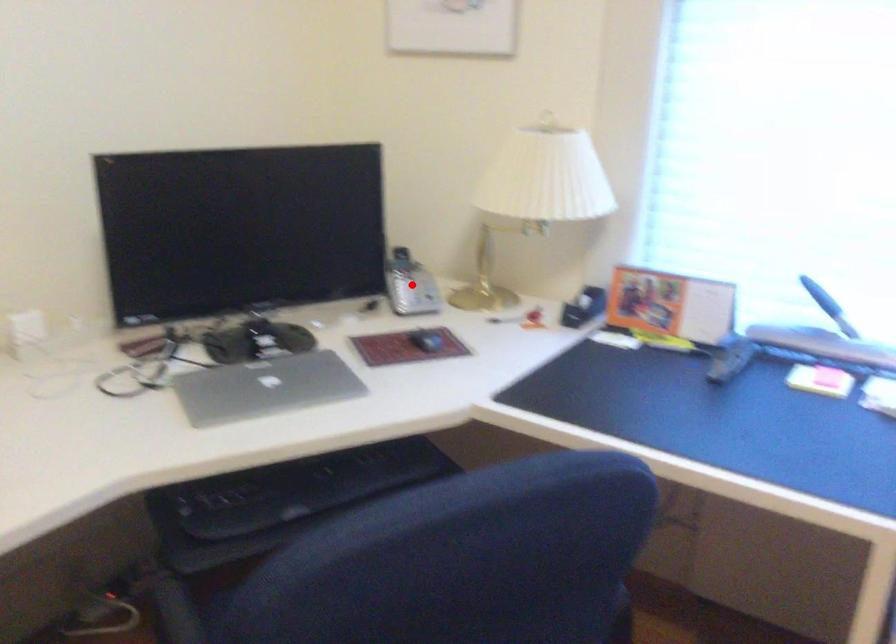
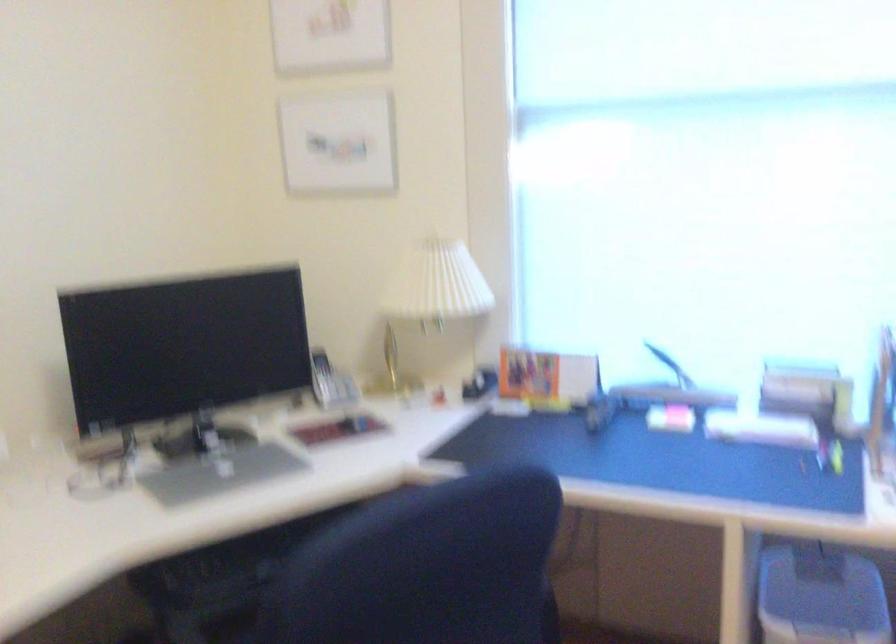
Question: I am providing you with two images of the same scene from different viewpoints. A red point is shown in image1. For the corresponding object point in image2, is it positioned nearer or farther from the camera?

Choices:
 (A) Nearer
 (B) Farther

Answer: (B)